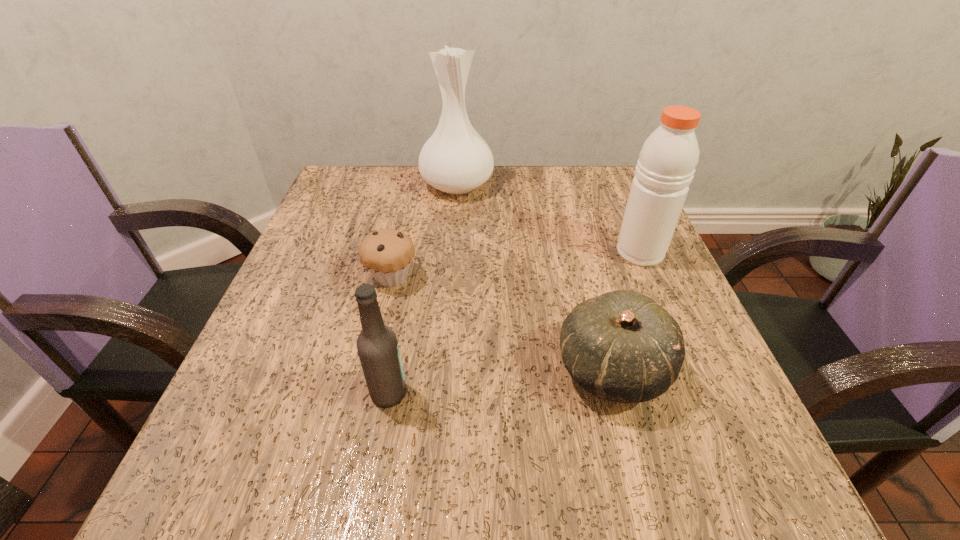
The width and height of the screenshot is (960, 540). I want to click on unoccupied position between the farthest object and the shaker, so click(548, 218).

Identify the location of free space between the shaker and the farthest object. The height and width of the screenshot is (540, 960). (548, 218).

At what (x,y) coordinates should I click in order to perform the action: click on vacant space in between the shortest object and the shaker. Please return your answer as a coordinate pair (x, y). Looking at the image, I should click on (516, 265).

The image size is (960, 540). I want to click on vacant space that's between the shortest object and the second shortest object, so tap(502, 323).

Image resolution: width=960 pixels, height=540 pixels. I want to click on blank region between the third tallest object and the farthest object, so click(422, 289).

Identify the location of free area in between the second shortest object and the shortest object. Image resolution: width=960 pixels, height=540 pixels. (502, 323).

The image size is (960, 540). I want to click on free point between the fourth tallest object and the muffin, so click(x=502, y=323).

Where is `empty space that is in between the gourd and the farthest object`? empty space that is in between the gourd and the farthest object is located at coordinates (535, 277).

Where is `unoccupied position between the vase and the shaker`? The image size is (960, 540). unoccupied position between the vase and the shaker is located at coordinates (548, 218).

Identify which object is located as the nearest to the shaker. Please provide its 2D coordinates. Your answer should be formatted as a tuple, i.e. [(x, y)], where the tuple contains the x and y coordinates of a point satisfying the conditions above.

[(622, 346)]